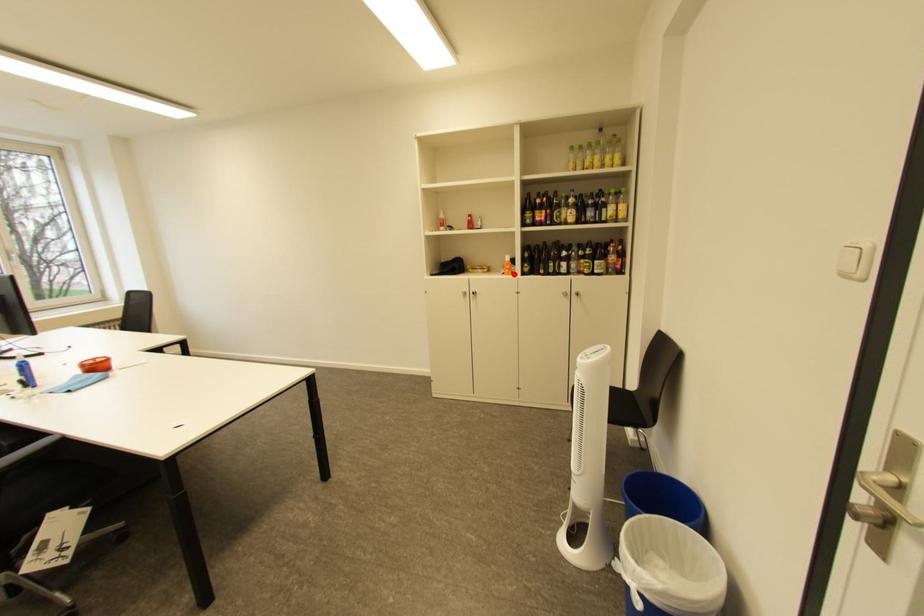
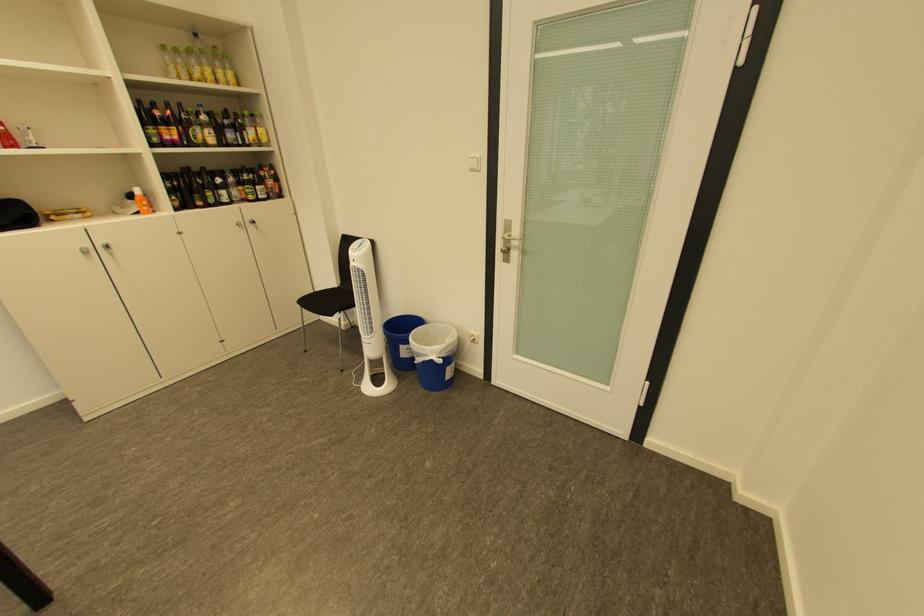
Where in the second image is the point corresponding to the highlighted location from the first image?

(148, 214)